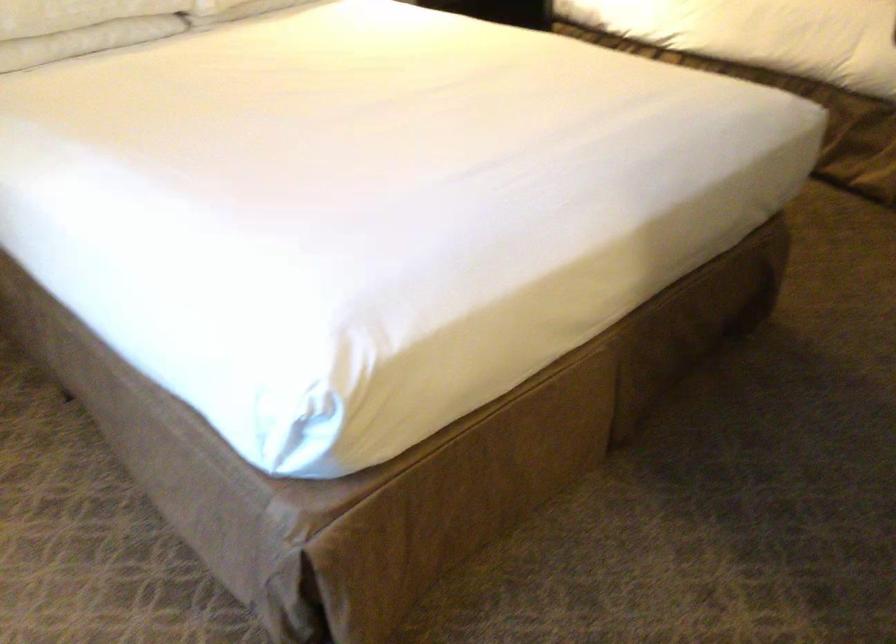
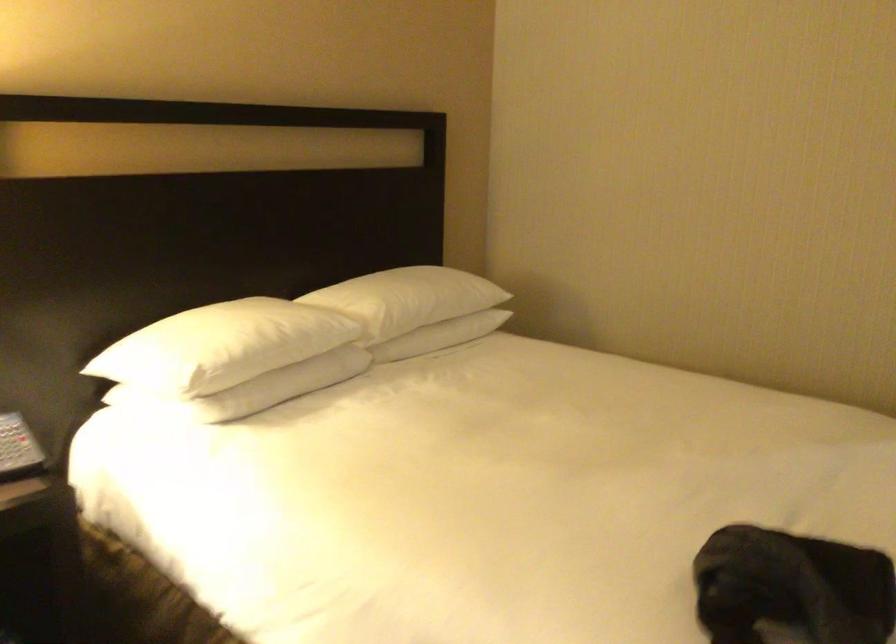
What movement of the cameraman would produce the second image?

The movement direction of the cameraman is right, forward.